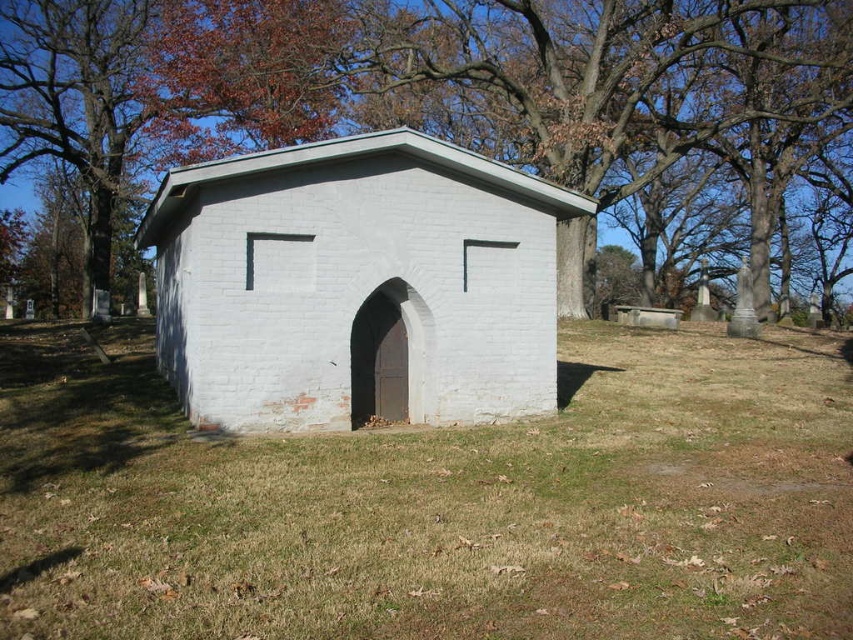
Question: Does white brick hut at center have a lesser width compared to brown leafy tree at upper left?

Choices:
 (A) no
 (B) yes

Answer: (B)

Question: Can you confirm if green grass at center is positioned above white brick hut at center?

Choices:
 (A) yes
 (B) no

Answer: (B)

Question: Which of the following is the farthest from the observer?

Choices:
 (A) (341, 406)
 (B) (111, 461)
 (C) (178, 17)
 (D) (219, 3)

Answer: (C)

Question: Which object is positioned farthest from the brown leafy tree at upper left?

Choices:
 (A) green grass at center
 (B) brown wood tree at upper center

Answer: (A)

Question: Is green grass at center closer to the viewer compared to brown wood tree at upper center?

Choices:
 (A) no
 (B) yes

Answer: (B)

Question: Which point is closer to the camera taking this photo?

Choices:
 (A) (224, 141)
 (B) (18, 536)
 (C) (264, 225)
 (D) (380, 84)

Answer: (B)